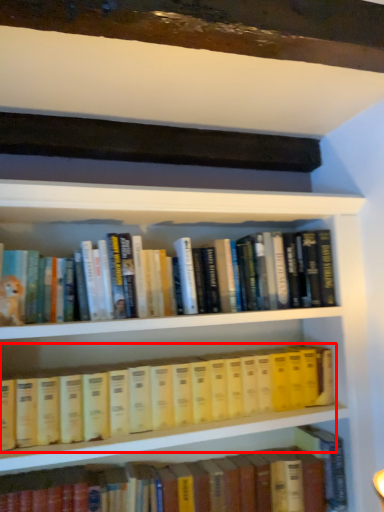
Question: Observing the image, what is the correct spatial positioning of book (annotated by the red box) in reference to book?

Choices:
 (A) right
 (B) left

Answer: (B)